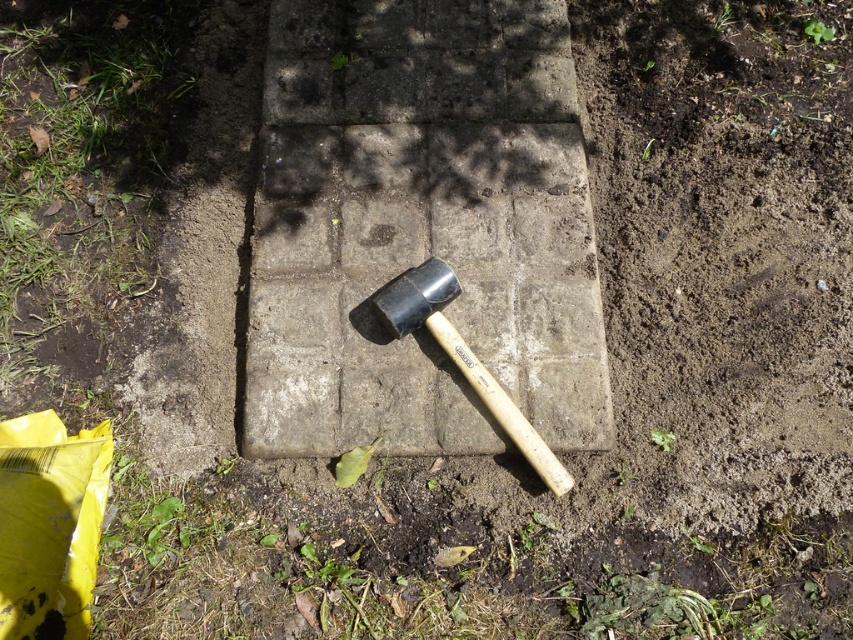
Which of these two, gray concrete at center or black rubber hammer at center, stands taller?

With more height is gray concrete at center.

Find the location of a particular element. This screenshot has height=640, width=853. gray concrete at center is located at coordinates (421, 228).

The width and height of the screenshot is (853, 640). Find the location of `gray concrete at center`. gray concrete at center is located at coordinates (421, 228).

Which is more to the right, gray concrete at center or green grass at lower left?

From the viewer's perspective, gray concrete at center appears more on the right side.

The height and width of the screenshot is (640, 853). Identify the location of gray concrete at center. (421, 228).

Does green grass at lower left have a greater width compared to black rubber hammer at center?

Indeed, green grass at lower left has a greater width compared to black rubber hammer at center.

Is point (22, 371) farther from viewer compared to point (430, 292)?

Yes, it is.

What do you see at coordinates (80, 172) in the screenshot? The height and width of the screenshot is (640, 853). I see `green grass at lower left` at bounding box center [80, 172].

Image resolution: width=853 pixels, height=640 pixels. Find the location of `green grass at lower left`. green grass at lower left is located at coordinates (80, 172).